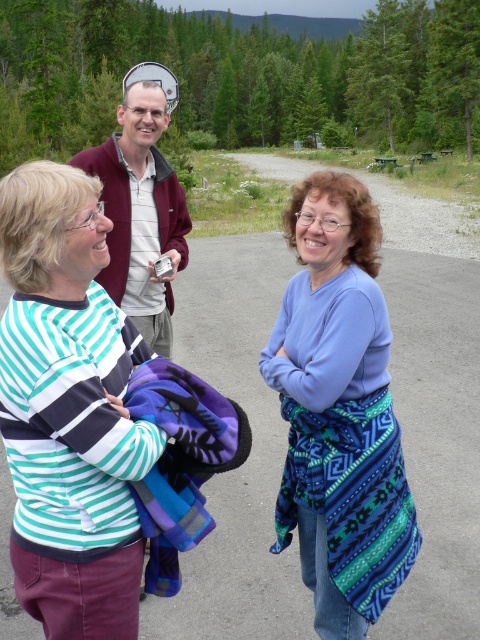
Question: Can you confirm if striped cotton shirt at left is thinner than blue woven shawl at center?

Choices:
 (A) yes
 (B) no

Answer: (A)

Question: Based on their relative distances, which object is farther from the blue woven shawl at center?

Choices:
 (A) striped cotton shirt at left
 (B) maroon fleece jacket at upper center

Answer: (B)

Question: Which point is farther to the camera?

Choices:
 (A) (337, 198)
 (B) (23, 582)
 (C) (121, 125)

Answer: (C)

Question: Is striped cotton shirt at left closer to the viewer compared to maroon fleece jacket at upper center?

Choices:
 (A) no
 (B) yes

Answer: (B)

Question: Does striped cotton shirt at left appear over blue woven shawl at center?

Choices:
 (A) no
 (B) yes

Answer: (B)

Question: Based on their relative distances, which object is farther from the maroon fleece jacket at upper center?

Choices:
 (A) blue woven shawl at center
 (B) striped cotton shirt at left

Answer: (B)